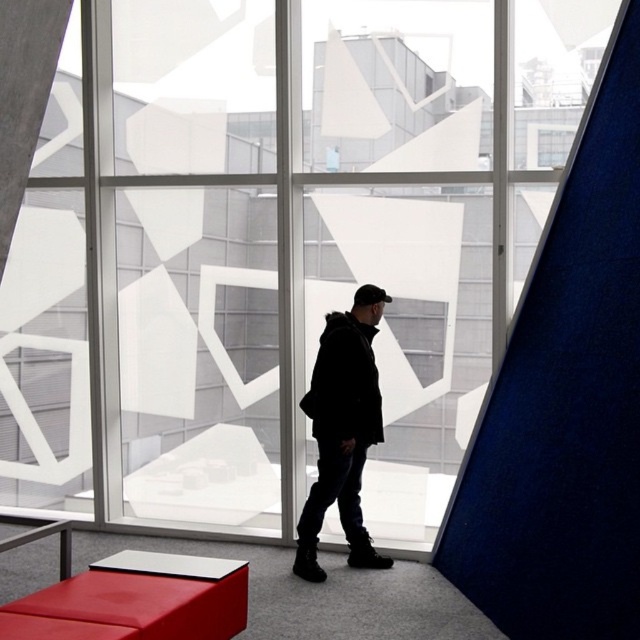
Can you confirm if black matte jacket at center is thinner than smooth leather stool at lower left?

Yes, black matte jacket at center is thinner than smooth leather stool at lower left.

Where is `black matte jacket at center`? The height and width of the screenshot is (640, 640). black matte jacket at center is located at coordinates [x=340, y=436].

Is point (348, 394) in front of point (122, 572)?

No, it is behind (122, 572).

I want to click on black matte jacket at center, so click(340, 436).

Does smooth leather stool at lower left have a lesser width compared to black matte baseball hat at center?

In fact, smooth leather stool at lower left might be wider than black matte baseball hat at center.

Is smooth leather stool at lower left to the left of black matte baseball hat at center from the viewer's perspective?

Correct, you'll find smooth leather stool at lower left to the left of black matte baseball hat at center.

This screenshot has height=640, width=640. Find the location of `smooth leather stool at lower left`. smooth leather stool at lower left is located at coordinates (147, 598).

I want to click on smooth leather stool at lower left, so click(147, 598).

Is black matte jacket at center taller than black matte baseball hat at center?

Yes, black matte jacket at center is taller than black matte baseball hat at center.

Is black matte jacket at center positioned behind black matte baseball hat at center?

No, black matte jacket at center is closer to the viewer.

Which is behind, point (312, 403) or point (368, 301)?

Positioned behind is point (368, 301).

The width and height of the screenshot is (640, 640). I want to click on black matte jacket at center, so click(x=340, y=436).